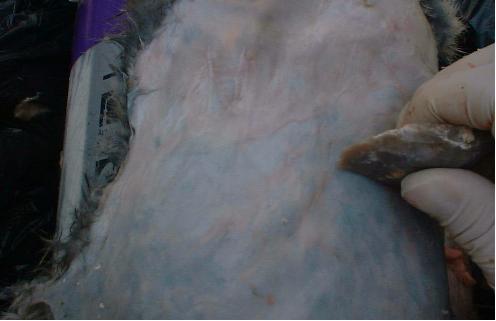
You are a GUI agent. You are given a task and a screenshot of the screen. Output one action in this format:
    pyautogui.click(x=<x>, y=<y>)
    Task: Click on the white fur
    
    Given the screenshot: What is the action you would take?
    pyautogui.click(x=247, y=144)